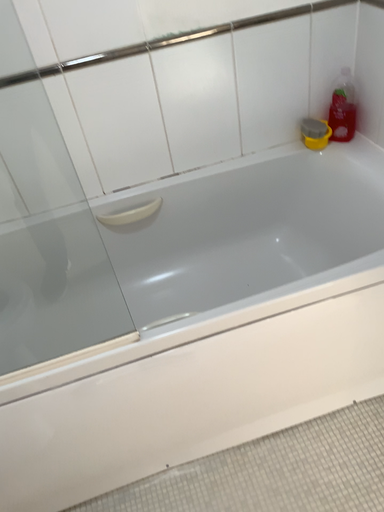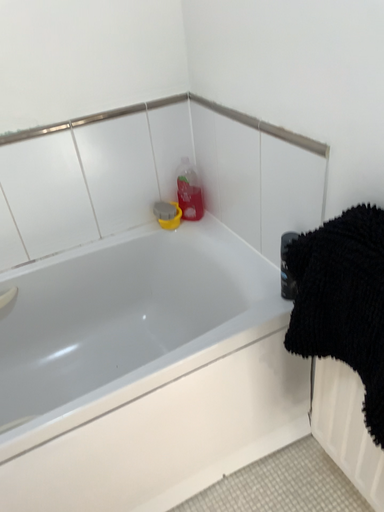
Question: Which way did the camera rotate in the video?

Choices:
 (A) rotated left
 (B) rotated right

Answer: (B)